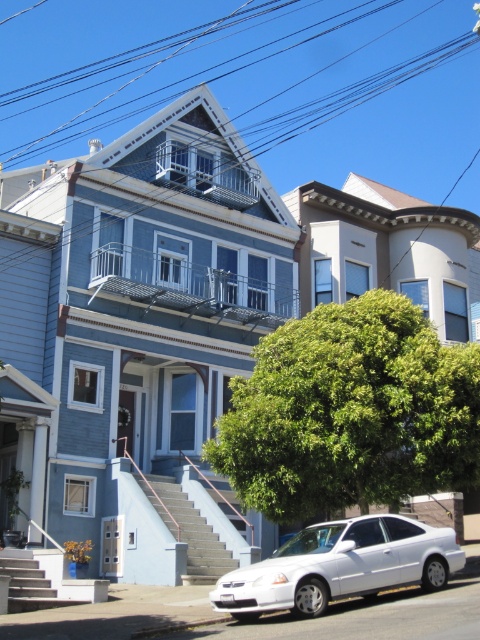
You are standing at the entrance of the house and want to walk to the green leafy tree at center. Which direction should you head relative to the house?

The green leafy tree at center is located at point (349,412), so you should head towards the center of the image relative to the house.

Consider the image. You are a delivery person standing at the smooth concrete stairs at lower left, and you need to deliver a package to the white glossy sedan at center. The delivery robot you are using has a maximum operating range of 15 meters. Can the robot reach the sedan from your current position?

The distance between the white glossy sedan at center and the smooth concrete stairs at lower left is 15.33 meters, which exceeds the robot maximum operating range of 15 meters. Therefore, the robot cannot reach the sedan from the current position.

You are standing in front of the house and notice the black wire at upper center and the green leafy tree at center. Which object is closer to you?

The black wire at upper center is closer to you because it is in front of the green leafy tree at center.